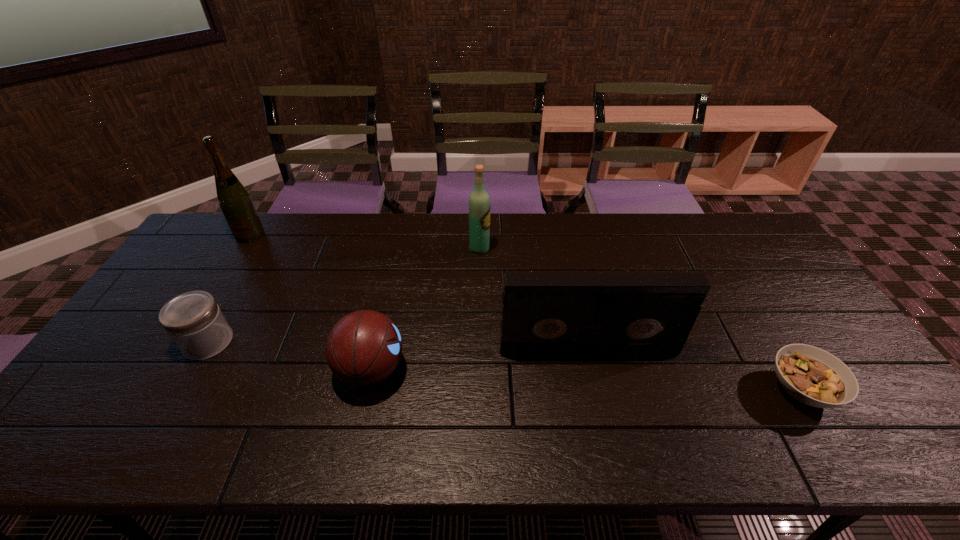
Find the location of a particular element. vacant space located on the front-facing side of the left wine bottle is located at coordinates (232, 262).

Where is `free space located on the front-facing side of the fourth object from left to right`? The image size is (960, 540). free space located on the front-facing side of the fourth object from left to right is located at coordinates (514, 249).

The image size is (960, 540). What are the coordinates of `vacant point located on the front side of the fifth object from left to right` in the screenshot? It's located at (604, 419).

The image size is (960, 540). I want to click on vacant space located 0.250m on the left of the fourth object from right to left, so click(238, 370).

At what (x,y) coordinates should I click in order to perform the action: click on free space located on the left of the jar. Please return your answer as a coordinate pair (x, y). This screenshot has width=960, height=540. Looking at the image, I should click on click(x=130, y=342).

Image resolution: width=960 pixels, height=540 pixels. I want to click on vacant region located 0.140m on the left of the stew, so click(x=709, y=390).

This screenshot has width=960, height=540. I want to click on object present at the near edge, so click(813, 376).

The image size is (960, 540). In order to click on object positioned at the left edge in this screenshot , I will do `click(236, 204)`.

Where is `object positioned at the right edge`? object positioned at the right edge is located at coordinates (813, 376).

Where is `object that is at the far left corner`? object that is at the far left corner is located at coordinates coord(236,204).